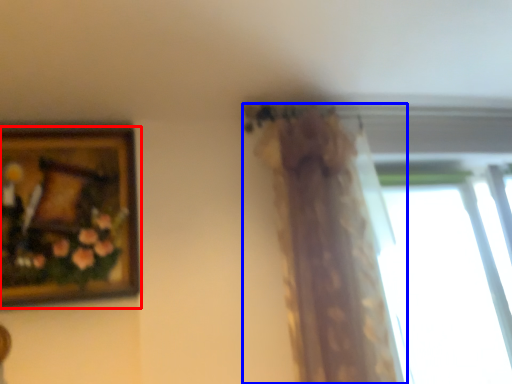
Question: Which object is closer to the camera taking this photo, picture frame (highlighted by a red box) or curtain (highlighted by a blue box)?

Choices:
 (A) picture frame
 (B) curtain

Answer: (B)